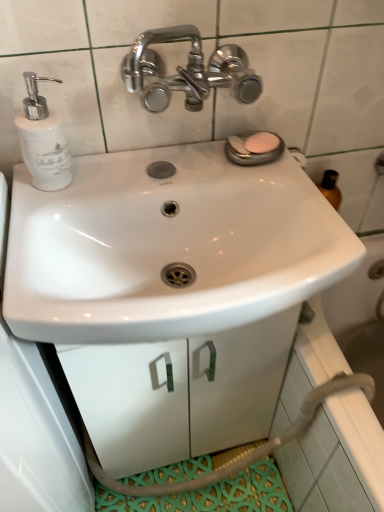
Question: Is pink matte soap at upper right thinner than white glossy soap dispenser at left?

Choices:
 (A) yes
 (B) no

Answer: (A)

Question: From the image's perspective, would you say pink matte soap at upper right is shown under white glossy soap dispenser at left?

Choices:
 (A) yes
 (B) no

Answer: (B)

Question: Can you confirm if pink matte soap at upper right is bigger than white glossy soap dispenser at left?

Choices:
 (A) yes
 (B) no

Answer: (B)

Question: Is the position of pink matte soap at upper right less distant than that of white glossy soap dispenser at left?

Choices:
 (A) no
 (B) yes

Answer: (A)

Question: Does pink matte soap at upper right have a greater height compared to white glossy soap dispenser at left?

Choices:
 (A) no
 (B) yes

Answer: (A)

Question: In the image, is white matte cabinet at center on the left side or the right side of white glossy soap dispenser at left?

Choices:
 (A) left
 (B) right

Answer: (B)

Question: Looking at their shapes, would you say white matte cabinet at center is wider or thinner than white glossy soap dispenser at left?

Choices:
 (A) thin
 (B) wide

Answer: (B)

Question: From the image's perspective, is white matte cabinet at center above or below white glossy soap dispenser at left?

Choices:
 (A) above
 (B) below

Answer: (B)

Question: Is white matte cabinet at center inside the boundaries of white glossy soap dispenser at left, or outside?

Choices:
 (A) inside
 (B) outside

Answer: (B)

Question: Considering their positions, is white glossy sink at center located in front of or behind pink matte soap at upper right?

Choices:
 (A) behind
 (B) front

Answer: (B)

Question: From the image's perspective, is white glossy sink at center located above or below pink matte soap at upper right?

Choices:
 (A) above
 (B) below

Answer: (B)

Question: Based on their sizes in the image, would you say white glossy sink at center is bigger or smaller than pink matte soap at upper right?

Choices:
 (A) small
 (B) big

Answer: (B)

Question: Is white glossy sink at center taller or shorter than pink matte soap at upper right?

Choices:
 (A) short
 (B) tall

Answer: (B)

Question: Looking at their shapes, would you say white glossy sink at center is wider or thinner than white matte cabinet at center?

Choices:
 (A) wide
 (B) thin

Answer: (A)

Question: Based on their sizes in the image, would you say white glossy sink at center is bigger or smaller than white matte cabinet at center?

Choices:
 (A) small
 (B) big

Answer: (A)